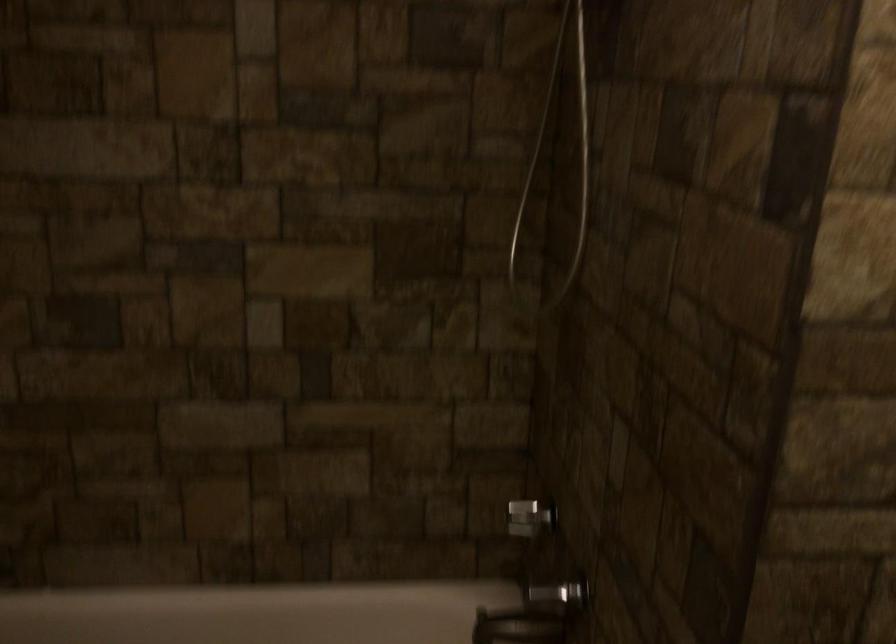
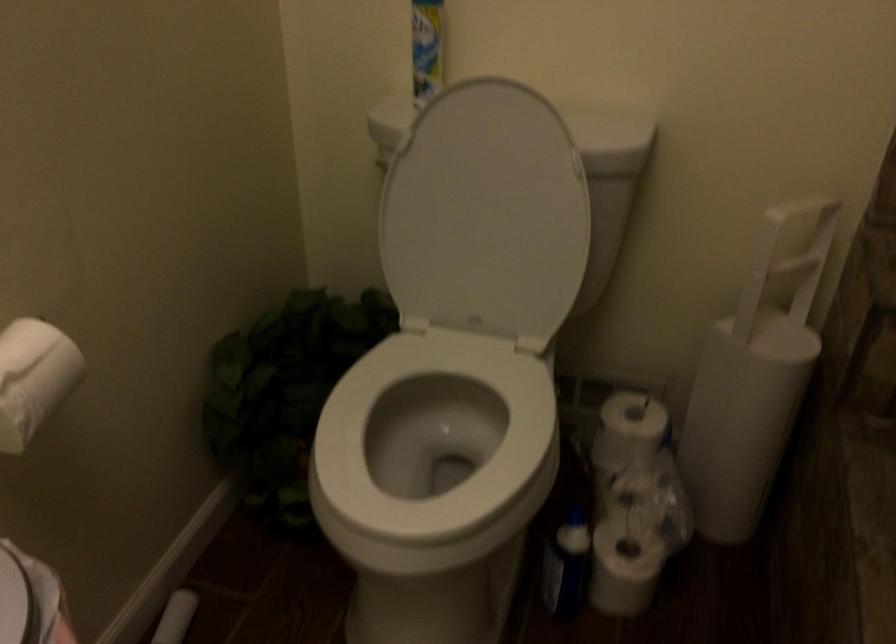
Based on the continuous images, in which direction is the camera rotating?

The rotation direction of the camera is left-down.